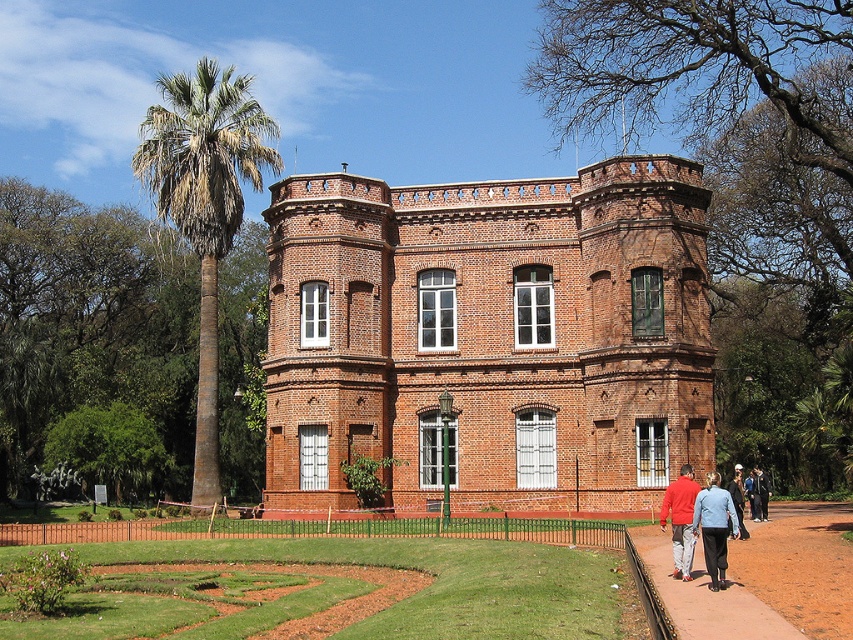
You are standing in front of the historic brick building and see the blue denim jacket at lower right. Where exactly is the blue denim jacket located in relation to the building?

The blue denim jacket at lower right is located at point (714, 528) relative to the building.

You are a delivery person carrying a package and need to walk along the brown dirt path at lower right. There is a blue denim jacket at center lying on the path. Can you walk around the jacket without leaving the path?

The brown dirt path at lower right might be wider than blue denim jacket at center, so there is a possibility that the path is wide enough to walk around the jacket without leaving the path. However, since the exact width isn not confirmed, it depends on the actual width of the path compared to the jacket.

You are standing in front of the brick building at center and notice a blue denim jacket at center lying nearby. If you want to place the jacket so it doesn not obstruct the view of the building, where should you position it relative to the building?

Since the brick building at center is wider than the blue denim jacket at center, you should position the blue denim jacket at center to the side of the building, ensuring it does not block the view of the entire structure.